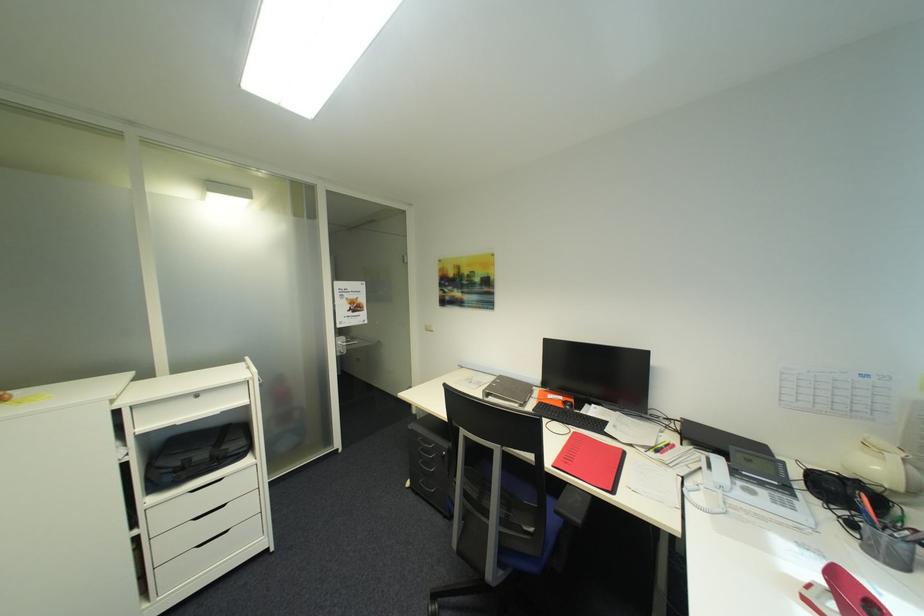
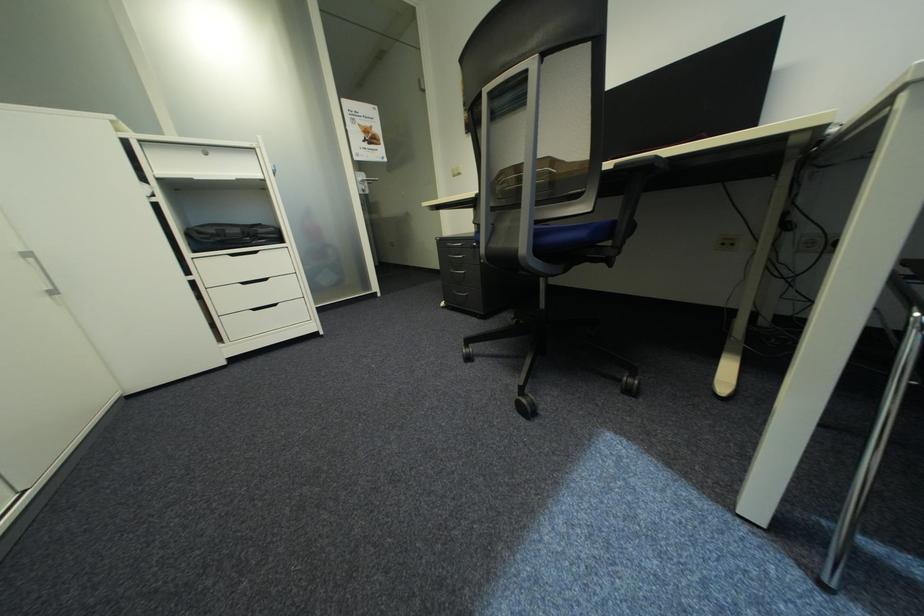
Find the pixel in the second image that matches point 190,460 in the first image.

(225, 230)